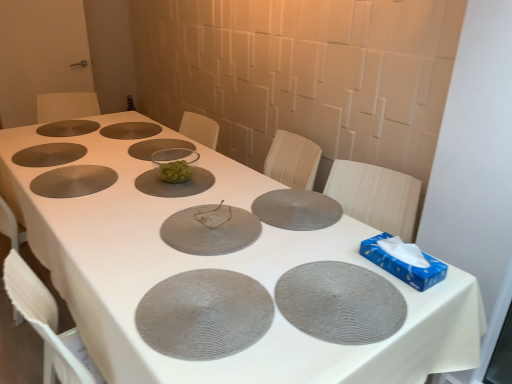
I want to click on spots to the right of matte gray placemat at left, which appears as the sixth glass plate when viewed from the back, so click(x=131, y=183).